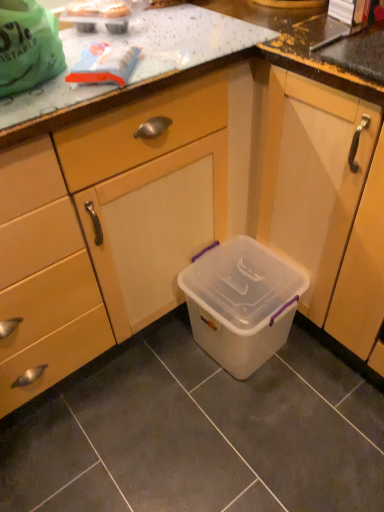
Question: Is transparent plastic container at lower center taller or shorter than transparent plastic storage box at center?

Choices:
 (A) tall
 (B) short

Answer: (A)

Question: From the image's perspective, is transparent plastic container at lower center positioned above or below transparent plastic storage box at center?

Choices:
 (A) above
 (B) below

Answer: (A)

Question: Based on their sizes in the image, would you say transparent plastic container at lower center is bigger or smaller than transparent plastic storage box at center?

Choices:
 (A) big
 (B) small

Answer: (A)

Question: Does point (301, 287) appear closer or farther from the camera than point (256, 224)?

Choices:
 (A) farther
 (B) closer

Answer: (B)

Question: In terms of height, does transparent plastic storage box at center look taller or shorter compared to transparent plastic container at lower center?

Choices:
 (A) short
 (B) tall

Answer: (A)

Question: Visually, is transparent plastic storage box at center positioned to the left or to the right of transparent plastic container at lower center?

Choices:
 (A) left
 (B) right

Answer: (A)

Question: Is transparent plastic storage box at center inside or outside of transparent plastic container at lower center?

Choices:
 (A) inside
 (B) outside

Answer: (B)